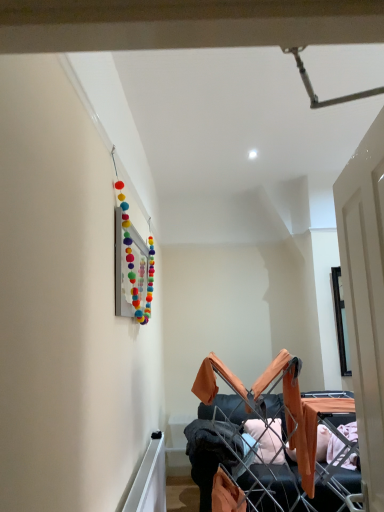
Question: Is orange fabric drying rack at lower right a part of dark gray fabric at center?

Choices:
 (A) yes
 (B) no

Answer: (B)

Question: From the image's perspective, does dark gray fabric at center appear lower than orange fabric drying rack at lower right?

Choices:
 (A) no
 (B) yes

Answer: (B)

Question: Does dark gray fabric at center have a lesser height compared to orange fabric drying rack at lower right?

Choices:
 (A) yes
 (B) no

Answer: (A)

Question: Does dark gray fabric at center lie behind orange fabric drying rack at lower right?

Choices:
 (A) no
 (B) yes

Answer: (B)

Question: Is dark gray fabric at center to the right of orange fabric drying rack at lower right from the viewer's perspective?

Choices:
 (A) no
 (B) yes

Answer: (A)

Question: From their relative heights in the image, would you say dark gray fabric at center is taller or shorter than white wooden door at right?

Choices:
 (A) tall
 (B) short

Answer: (B)

Question: Is dark gray fabric at center wider or thinner than white wooden door at right?

Choices:
 (A) thin
 (B) wide

Answer: (B)

Question: Does point (230, 449) appear closer or farther from the camera than point (344, 246)?

Choices:
 (A) farther
 (B) closer

Answer: (A)

Question: Would you say dark gray fabric at center is inside or outside white wooden door at right?

Choices:
 (A) outside
 (B) inside

Answer: (A)

Question: From the image's perspective, is white wooden door at right positioned above or below orange fabric drying rack at lower right?

Choices:
 (A) below
 (B) above

Answer: (B)

Question: Does point (362, 150) appear closer or farther from the camera than point (299, 504)?

Choices:
 (A) closer
 (B) farther

Answer: (A)

Question: Looking at their shapes, would you say white wooden door at right is wider or thinner than orange fabric drying rack at lower right?

Choices:
 (A) wide
 (B) thin

Answer: (B)

Question: Is white wooden door at right in front of or behind orange fabric drying rack at lower right in the image?

Choices:
 (A) front
 (B) behind

Answer: (A)

Question: Is white wooden door at right in front of or behind dark gray fabric at center in the image?

Choices:
 (A) behind
 (B) front

Answer: (B)

Question: Which is correct: white wooden door at right is inside dark gray fabric at center, or outside of it?

Choices:
 (A) inside
 (B) outside

Answer: (B)